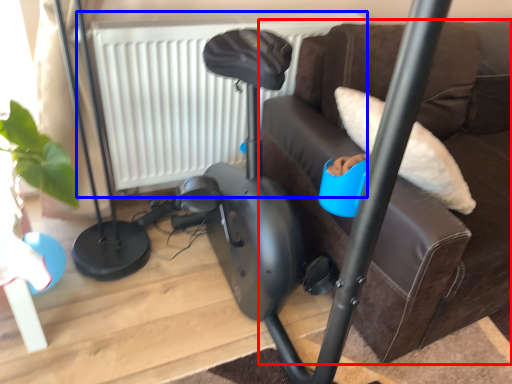
Question: Which object is closer to the camera taking this photo, furniture (highlighted by a red box) or radiator (highlighted by a blue box)?

Choices:
 (A) furniture
 (B) radiator

Answer: (A)